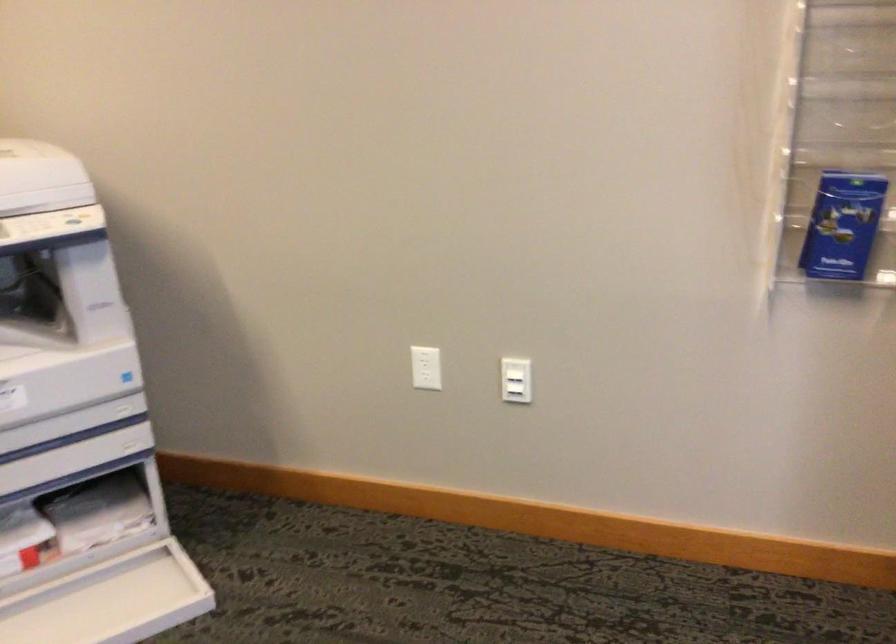
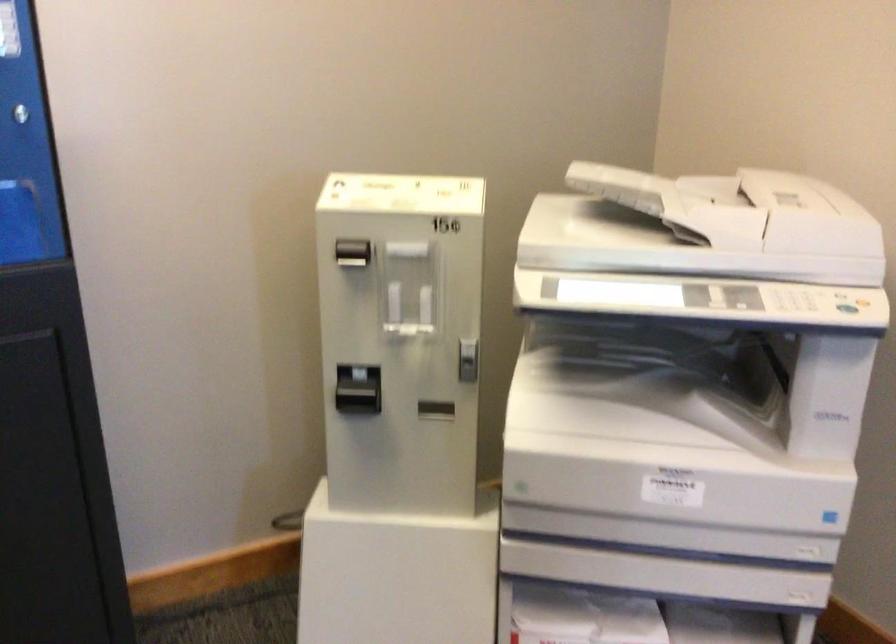
Question: Based on the continuous images, in which direction is the camera rotating? Reply with the corresponding letter.

Choices:
 (A) Left
 (B) Right
 (C) Up
 (D) Down

Answer: (A)